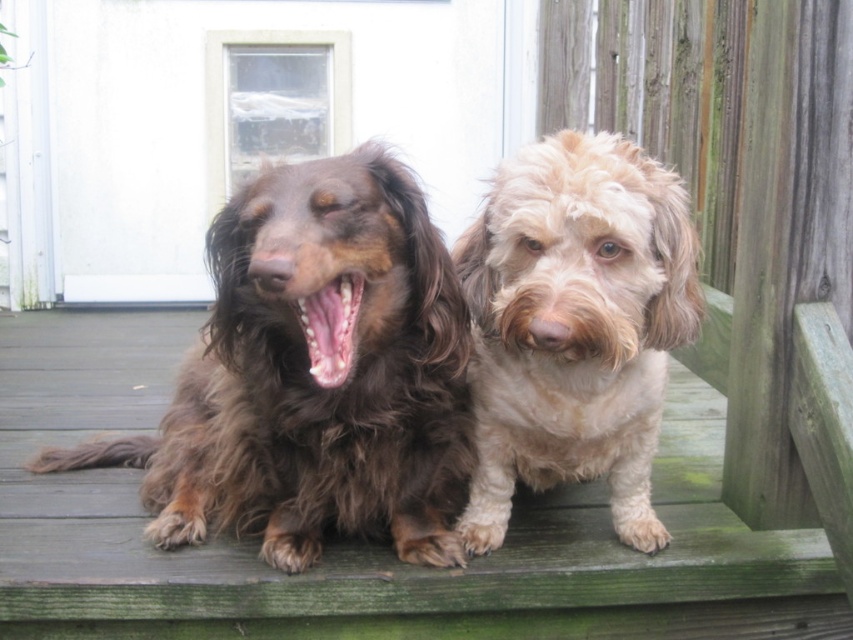
You are a photographer trying to capture both the green wood deck at center and the bright pink glossy teeth at center in a single shot. Given that your camera has a maximum focus range of 30 inches, will you be able to include both in the frame without moving the camera?

The green wood deck at center and bright pink glossy teeth at center are 33.88 inches apart. Since the distance between them exceeds the camera maximum focus range of 30 inches, you won not be able to capture both in a single shot without moving the camera.

You are standing at the edge of the deck and want to place a small potted plant on the green wood deck at center. Where exactly should you place it?

You should place the small potted plant at point [364,544] on the green wood deck at center as that is the exact location specified.

Looking at this image, you are a painter wanting to paint a scene of two dogs on a deck. You have a canvas that can only accommodate objects up to 1.2 meters wide. Given the green wood deck at center and the bright pink glossy teeth at center, which object should you prioritize fitting on your canvas to ensure it fits?

The green wood deck at center might be wider than bright pink glossy teeth at center, so to ensure it fits on the canvas, you should prioritize fitting the green wood deck at center first since it is wider and the canvas can accommodate up to 1.2 meters.